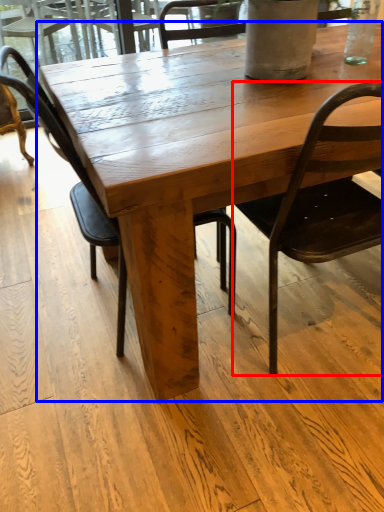
Question: Which of the following is the farthest to the observer, chair (highlighted by a red box) or coffee table (highlighted by a blue box)?

Choices:
 (A) chair
 (B) coffee table

Answer: (B)